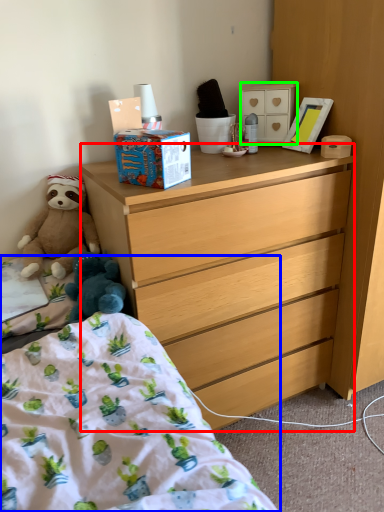
Question: Which object is positioned farthest from desk (highlighted by a red box)? Select from bed (highlighted by a blue box) and cabinetry (highlighted by a green box).

Choices:
 (A) bed
 (B) cabinetry

Answer: (B)